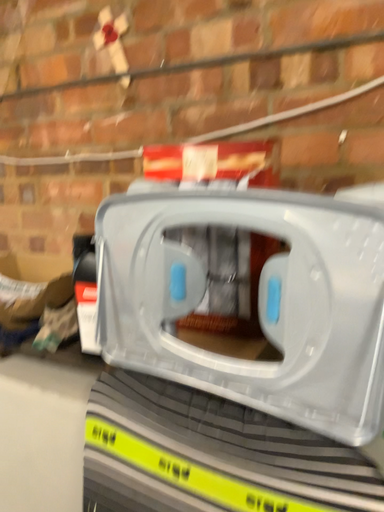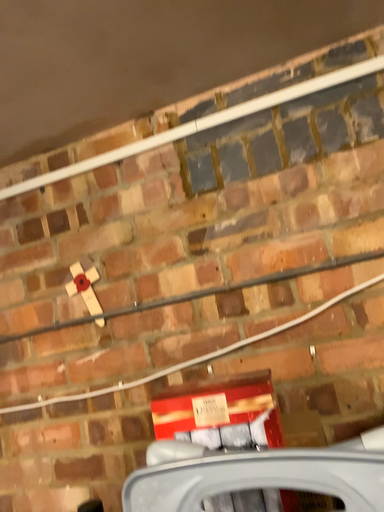
Question: How did the camera likely rotate when shooting the video?

Choices:
 (A) rotated upward
 (B) rotated downward

Answer: (A)